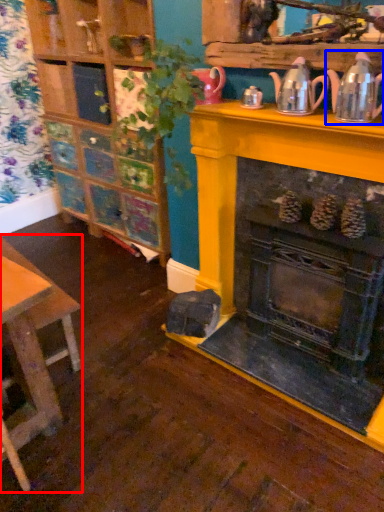
Question: Which of the following is the farthest to the observer, table (highlighted by a red box) or tea pot (highlighted by a blue box)?

Choices:
 (A) table
 (B) tea pot

Answer: (A)